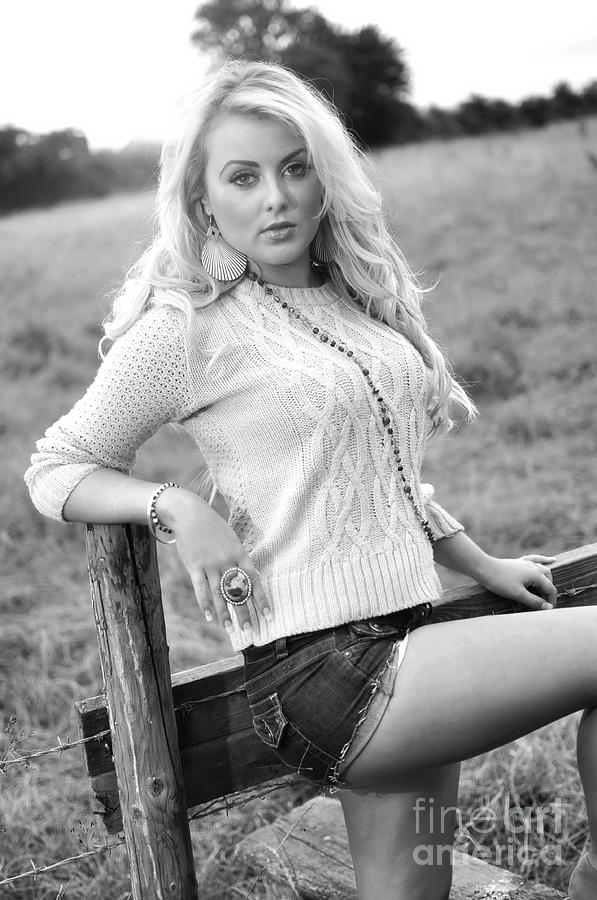
Where is `wood post`? The height and width of the screenshot is (900, 597). wood post is located at coordinates (158, 747).